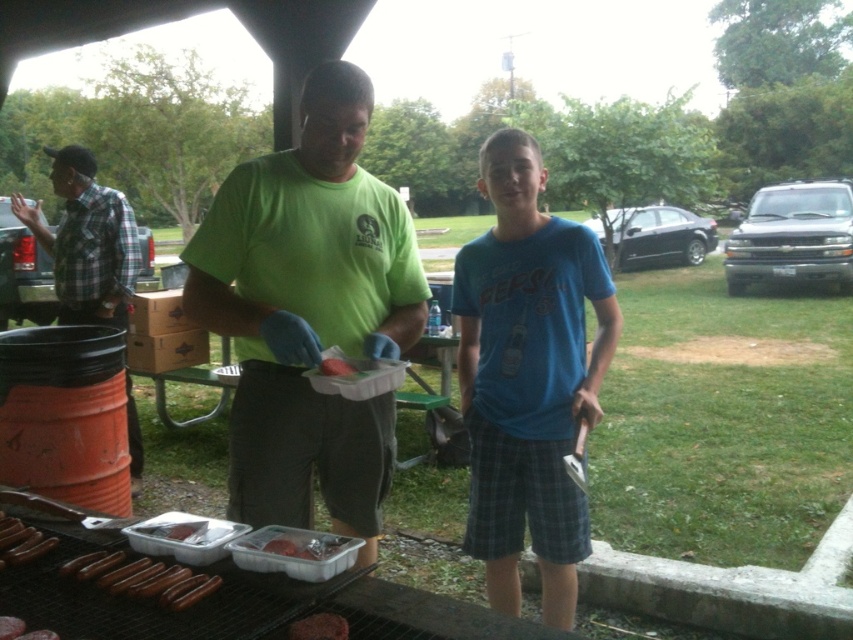
Which of these two, smooth brown meat at center or smooth plastic container at grill front, stands shorter?

smooth plastic container at grill front

Is smooth brown meat at center wider than smooth plastic container at grill front?

Indeed, smooth brown meat at center has a greater width compared to smooth plastic container at grill front.

Who is more forward, (x=331, y=637) or (x=190, y=532)?

Point (x=331, y=637)

Find the location of `smooth brown meat at center`. smooth brown meat at center is located at coordinates (318, 627).

Does plaid fabric shirt at left have a greater height compared to shiny brown hot dogs at lower left?

Yes, plaid fabric shirt at left is taller than shiny brown hot dogs at lower left.

This screenshot has height=640, width=853. Find the location of `plaid fabric shirt at left`. plaid fabric shirt at left is located at coordinates (86, 241).

Which is behind, point (18, 548) or point (331, 368)?

Positioned behind is point (331, 368).

At what (x,y) coordinates should I click in order to perform the action: click on brown matte hot dog at lower left. Please return your answer as a coordinate pair (x, y). Looking at the image, I should click on (21, 541).